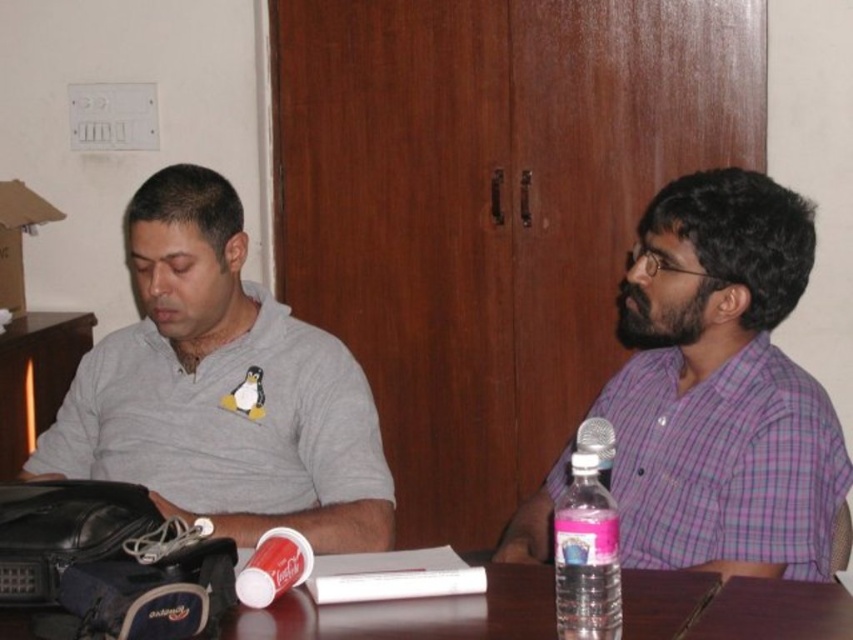
Does purple checkered shirt at center come in front of gray matte shirt at left?

Yes, purple checkered shirt at center is closer to the viewer.

Can you confirm if purple checkered shirt at center is positioned above gray matte shirt at left?

Yes, purple checkered shirt at center is above gray matte shirt at left.

Image resolution: width=853 pixels, height=640 pixels. What do you see at coordinates (721, 387) in the screenshot? I see `purple checkered shirt at center` at bounding box center [721, 387].

Locate an element on the screen. The image size is (853, 640). purple checkered shirt at center is located at coordinates click(x=721, y=387).

Which of these two, smooth wooden table at center or pink translucent water bottle at right, stands taller?

pink translucent water bottle at right

Looking at this image, between smooth wooden table at center and pink translucent water bottle at right, which one is positioned lower?

smooth wooden table at center

What do you see at coordinates (415, 612) in the screenshot? Image resolution: width=853 pixels, height=640 pixels. I see `smooth wooden table at center` at bounding box center [415, 612].

At what (x,y) coordinates should I click in order to perform the action: click on smooth wooden table at center. Please return your answer as a coordinate pair (x, y). Looking at the image, I should click on (415, 612).

From the picture: Which is below, purple checkered shirt at center or pink translucent water bottle at right?

pink translucent water bottle at right

Which is more to the left, purple checkered shirt at center or pink translucent water bottle at right?

From the viewer's perspective, pink translucent water bottle at right appears more on the left side.

Does point (740, 557) come behind point (590, 550)?

Yes.

At what (x,y) coordinates should I click in order to perform the action: click on purple checkered shirt at center. Please return your answer as a coordinate pair (x, y). The width and height of the screenshot is (853, 640). Looking at the image, I should click on (721, 387).